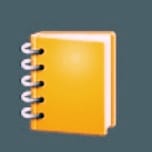
Locate an element on the screen. The width and height of the screenshot is (152, 152). top and side edges of the papers inside the notebook is located at coordinates (107, 63), (73, 36).